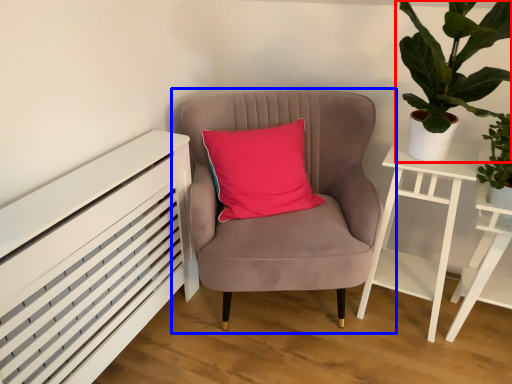
Question: Which object is further to the camera taking this photo, houseplant (highlighted by a red box) or chair (highlighted by a blue box)?

Choices:
 (A) houseplant
 (B) chair

Answer: (B)